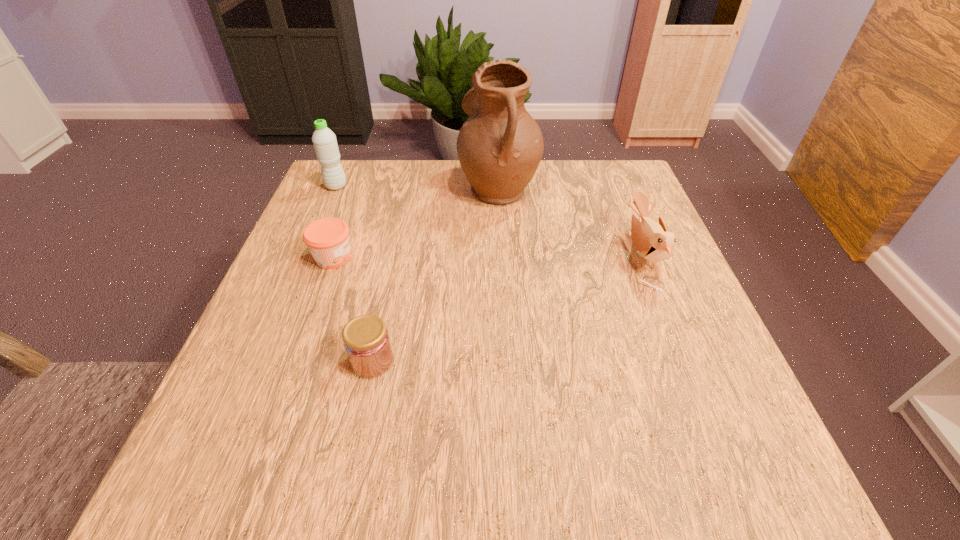
I want to click on empty location between the farther jam and the nearest object, so (353, 309).

This screenshot has height=540, width=960. What are the coordinates of `free space between the right jam and the water bottle` in the screenshot? It's located at click(x=354, y=274).

The height and width of the screenshot is (540, 960). Find the location of `vacant region between the water bottle and the third shortest object`. vacant region between the water bottle and the third shortest object is located at coordinates (489, 221).

The image size is (960, 540). What are the coordinates of `empty space between the right jam and the bird` in the screenshot? It's located at pos(507,308).

Locate an element on the screen. The width and height of the screenshot is (960, 540). free spot between the bird and the water bottle is located at coordinates coord(489,221).

Identify the location of free point between the third tallest object and the farther jam. coord(488,257).

You are a GUI agent. You are given a task and a screenshot of the screen. Output one action in this format:
    pyautogui.click(x=<x>, y=<y>)
    Task: Click on the unoccupied position between the farther jam and the fourth object from left to right
    The height and width of the screenshot is (540, 960).
    Given the screenshot: What is the action you would take?
    pyautogui.click(x=416, y=222)

Where is `vacant point located between the nearer jam and the fourth shortest object`? vacant point located between the nearer jam and the fourth shortest object is located at coordinates (354, 274).

Select which object appears as the fourth closest to the nearer jam. Please provide its 2D coordinates. Your answer should be formatted as a tuple, i.e. [(x, y)], where the tuple contains the x and y coordinates of a point satisfying the conditions above.

[(324, 140)]

In order to click on object that stands as the third closest to the nearer jam in this screenshot , I will do `click(651, 239)`.